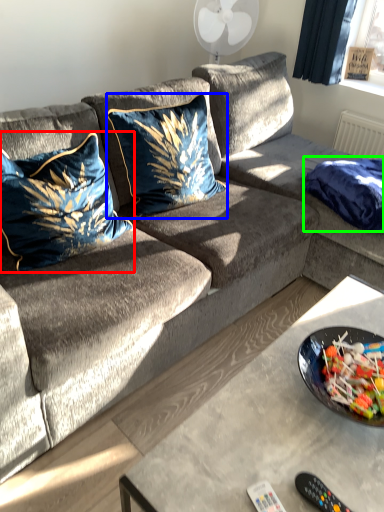
Question: Estimate the real-world distances between objects in this image. Which object is closer to pillow (highlighted by a red box), pillow (highlighted by a blue box) or blanket (highlighted by a green box)?

Choices:
 (A) pillow
 (B) blanket

Answer: (A)